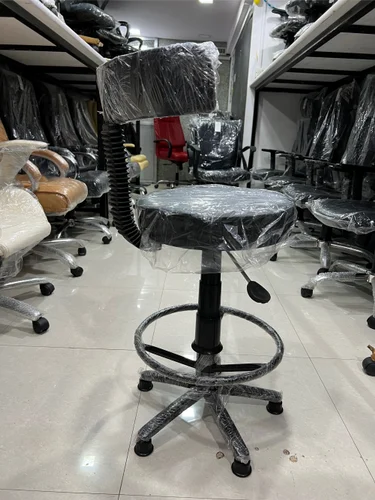
The height and width of the screenshot is (500, 375). Identify the location of brown chair. pyautogui.click(x=64, y=193).